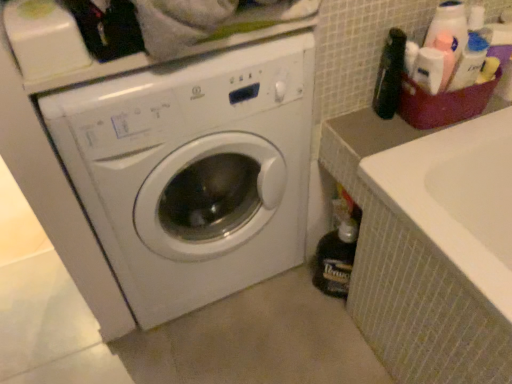
The image size is (512, 384). I want to click on plastic basket at upper right, so click(443, 103).

What are the coordinates of `black plastic bottle at upper right, which appears as the first bottle when viewed from the front` in the screenshot? It's located at (390, 75).

What do you see at coordinates (390, 75) in the screenshot? This screenshot has width=512, height=384. I see `black plastic bottle at upper right, which is the 2th bottle in back-to-front order` at bounding box center [390, 75].

The width and height of the screenshot is (512, 384). What do you see at coordinates (193, 172) in the screenshot? I see `white glossy washing machine at center` at bounding box center [193, 172].

Find the location of `plastic basket at upper right`. plastic basket at upper right is located at coordinates (443, 103).

Do you think dark brown glass bottle at lower right, the second bottle in the front-to-back sequence, is within white glossy washing machine at center, or outside of it?

dark brown glass bottle at lower right, the second bottle in the front-to-back sequence, exists outside the volume of white glossy washing machine at center.

From the image's perspective, is dark brown glass bottle at lower right, the second bottle in the front-to-back sequence, on top of white glossy washing machine at center?

Actually, dark brown glass bottle at lower right, the second bottle in the front-to-back sequence, appears below white glossy washing machine at center in the image.

From the image's perspective, who appears lower, dark brown glass bottle at lower right, the second bottle in the front-to-back sequence, or plastic basket at upper right?

dark brown glass bottle at lower right, the second bottle in the front-to-back sequence, from the image's perspective.

Between dark brown glass bottle at lower right, which appears as the 2th bottle when viewed from the top, and plastic basket at upper right, which one has larger size?

dark brown glass bottle at lower right, which appears as the 2th bottle when viewed from the top, is bigger.

Is dark brown glass bottle at lower right, which is the 1th bottle from back to front, with plastic basket at upper right?

No, dark brown glass bottle at lower right, which is the 1th bottle from back to front, is not touching plastic basket at upper right.

In the scene shown: Does dark brown glass bottle at lower right, which is the 1th bottle from back to front, have a greater width compared to plastic basket at upper right?

Incorrect, the width of dark brown glass bottle at lower right, which is the 1th bottle from back to front, does not surpass that of plastic basket at upper right.

Is black plastic bottle at upper right, which is the 2th bottle in back-to-front order, to the right of plastic basket at upper right from the viewer's perspective?

No, black plastic bottle at upper right, which is the 2th bottle in back-to-front order, is not to the right of plastic basket at upper right.

Is black plastic bottle at upper right, which appears as the first bottle when viewed from the front, positioned with its back to plastic basket at upper right?

No, black plastic bottle at upper right, which appears as the first bottle when viewed from the front,'s orientation is not away from plastic basket at upper right.

Is black plastic bottle at upper right, which is the 2th bottle in back-to-front order, shorter than plastic basket at upper right?

No, black plastic bottle at upper right, which is the 2th bottle in back-to-front order, is not shorter than plastic basket at upper right.

Between black plastic bottle at upper right, the 2th bottle ordered from the bottom, and plastic basket at upper right, which one is positioned behind?

plastic basket at upper right is further away from the camera.

Which is more to the left, plastic basket at upper right or white glossy washing machine at center?

white glossy washing machine at center.

From a real-world perspective, who is located higher, plastic basket at upper right or white glossy washing machine at center?

plastic basket at upper right is physically above.

In the image, is plastic basket at upper right positioned in front of or behind white glossy washing machine at center?

plastic basket at upper right is behind white glossy washing machine at center.

How different are the orientations of plastic basket at upper right and white glossy washing machine at center in degrees?

The angular difference between plastic basket at upper right and white glossy washing machine at center is 3.4 degrees.

From a real-world perspective, between plastic basket at upper right and black plastic bottle at upper right, which ranks as the 1th bottle in top-to-bottom order, who is vertically higher?

black plastic bottle at upper right, which ranks as the 1th bottle in top-to-bottom order, is physically above.

Considering the sizes of objects plastic basket at upper right and black plastic bottle at upper right, which ranks as the 1th bottle in top-to-bottom order, in the image provided, who is smaller, plastic basket at upper right or black plastic bottle at upper right, which ranks as the 1th bottle in top-to-bottom order,?

With smaller size is black plastic bottle at upper right, which ranks as the 1th bottle in top-to-bottom order.

Which is in front, point (409, 90) or point (395, 55)?

The point (395, 55) is more forward.

Is plastic basket at upper right surrounding black plastic bottle at upper right, which ranks as the 1th bottle in top-to-bottom order?

No, black plastic bottle at upper right, which ranks as the 1th bottle in top-to-bottom order, is located outside of plastic basket at upper right.

Between point (163, 238) and point (390, 103), which one is positioned behind?

The point (390, 103) is more distant.

Can you confirm if white glossy washing machine at center is shorter than black plastic bottle at upper right, which appears as the first bottle when viewed from the front?

In fact, white glossy washing machine at center may be taller than black plastic bottle at upper right, which appears as the first bottle when viewed from the front.

Is black plastic bottle at upper right, which ranks as the 1th bottle in top-to-bottom order, at the back of white glossy washing machine at center?

That's not correct — white glossy washing machine at center is not looking away from black plastic bottle at upper right, which ranks as the 1th bottle in top-to-bottom order.

Is black plastic bottle at upper right, which appears as the first bottle when viewed from the front, located outside dark brown glass bottle at lower right, the first bottle ordered from the bottom?

Yes, black plastic bottle at upper right, which appears as the first bottle when viewed from the front, is outside of dark brown glass bottle at lower right, the first bottle ordered from the bottom.

Does point (398, 98) appear closer or farther from the camera than point (328, 261)?

Point (398, 98).

Between black plastic bottle at upper right, which is the 2th bottle in back-to-front order, and dark brown glass bottle at lower right, which appears as the 2th bottle when viewed from the top, which one appears on the right side from the viewer's perspective?

From the viewer's perspective, black plastic bottle at upper right, which is the 2th bottle in back-to-front order, appears more on the right side.

Which object is further away from the camera taking this photo, black plastic bottle at upper right, which ranks as the 1th bottle in top-to-bottom order, or dark brown glass bottle at lower right, which is the 1th bottle from back to front?

dark brown glass bottle at lower right, which is the 1th bottle from back to front, is behind.

What are the coordinates of `bottle that is the 2nd object located behind the white glossy washing machine at center` in the screenshot? It's located at (336, 259).

Find the location of `basket above the dark brown glass bottle at lower right, which is the 1th bottle from back to front (from a real-world perspective)`. basket above the dark brown glass bottle at lower right, which is the 1th bottle from back to front (from a real-world perspective) is located at coordinates pos(443,103).

Which object lies nearer to the anchor point black plastic bottle at upper right, the 2th bottle ordered from the bottom, dark brown glass bottle at lower right, which is the 1th bottle from back to front, or white glossy washing machine at center?

dark brown glass bottle at lower right, which is the 1th bottle from back to front, is closer to black plastic bottle at upper right, the 2th bottle ordered from the bottom.

Considering their positions, is dark brown glass bottle at lower right, the second bottle in the front-to-back sequence, positioned closer to white glossy washing machine at center than black plastic bottle at upper right, which is the 2th bottle in back-to-front order?

dark brown glass bottle at lower right, the second bottle in the front-to-back sequence, is positioned closer to the anchor white glossy washing machine at center.

When comparing their distances from dark brown glass bottle at lower right, the second bottle in the front-to-back sequence, does plastic basket at upper right or white glossy washing machine at center seem further?

plastic basket at upper right lies further to dark brown glass bottle at lower right, the second bottle in the front-to-back sequence, than the other object.

Which object lies further to the anchor point dark brown glass bottle at lower right, which is the 1th bottle from back to front, white glossy washing machine at center or plastic basket at upper right?

plastic basket at upper right.

Estimate the real-world distances between objects in this image. Which object is closer to dark brown glass bottle at lower right, which appears as the 2th bottle when viewed from the top, black plastic bottle at upper right, the 2th bottle ordered from the bottom, or plastic basket at upper right?

plastic basket at upper right is positioned closer to the anchor dark brown glass bottle at lower right, which appears as the 2th bottle when viewed from the top.

Considering their positions, is plastic basket at upper right positioned further to white glossy washing machine at center than dark brown glass bottle at lower right, which is the 1th bottle from back to front?

Among the two, plastic basket at upper right is located further to white glossy washing machine at center.

When comparing their distances from dark brown glass bottle at lower right, which is the 1th bottle from back to front, does black plastic bottle at upper right, which appears as the first bottle when viewed from the front, or white glossy washing machine at center seem closer?

The object closer to dark brown glass bottle at lower right, which is the 1th bottle from back to front, is white glossy washing machine at center.

Which object lies further to the anchor point plastic basket at upper right, black plastic bottle at upper right, which ranks as the 1th bottle in top-to-bottom order, or dark brown glass bottle at lower right, which appears as the 2th bottle when viewed from the top?

dark brown glass bottle at lower right, which appears as the 2th bottle when viewed from the top, is positioned further to the anchor plastic basket at upper right.

Image resolution: width=512 pixels, height=384 pixels. Find the location of `basket between black plastic bottle at upper right, which is the 2th bottle in back-to-front order, and dark brown glass bottle at lower right, the first bottle ordered from the bottom, vertically`. basket between black plastic bottle at upper right, which is the 2th bottle in back-to-front order, and dark brown glass bottle at lower right, the first bottle ordered from the bottom, vertically is located at coordinates (443, 103).

I want to click on bottle between white glossy washing machine at center and black plastic bottle at upper right, which appears as the first bottle when viewed from the front, from left to right, so click(x=336, y=259).